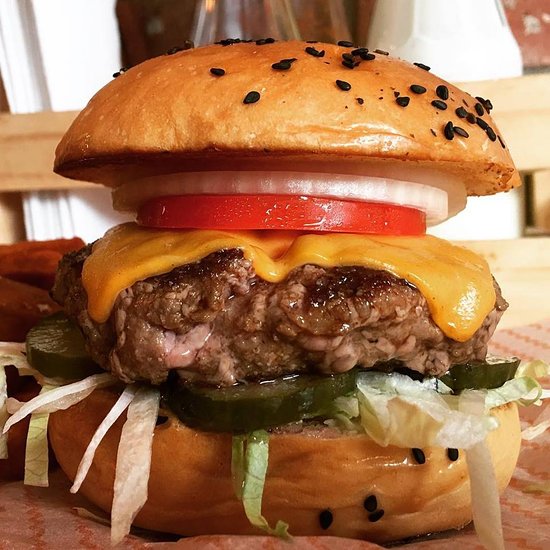
Where is `window`? This screenshot has height=550, width=550. window is located at coordinates (470, 60), (82, 67).